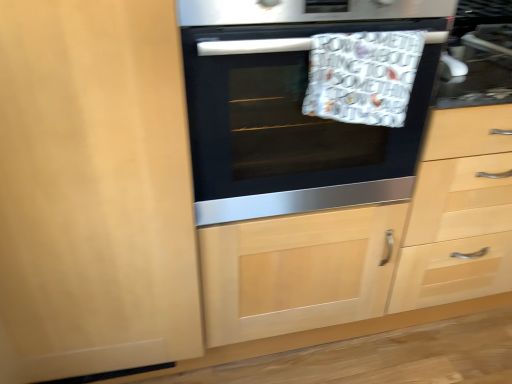
Question: Does black glass oven at center turn towards matte wood dresser at center?

Choices:
 (A) no
 (B) yes

Answer: (A)

Question: Would you say black glass oven at center is outside matte wood dresser at center?

Choices:
 (A) yes
 (B) no

Answer: (A)

Question: Considering the relative sizes of black glass oven at center and matte wood dresser at center in the image provided, is black glass oven at center wider than matte wood dresser at center?

Choices:
 (A) no
 (B) yes

Answer: (B)

Question: Can you confirm if black glass oven at center is thinner than matte wood dresser at center?

Choices:
 (A) no
 (B) yes

Answer: (A)

Question: Does black glass oven at center lie behind matte wood dresser at center?

Choices:
 (A) no
 (B) yes

Answer: (A)

Question: From a real-world perspective, is black glass oven at center positioned over matte wood dresser at center based on gravity?

Choices:
 (A) no
 (B) yes

Answer: (B)

Question: Is matte wood dresser at center positioned before black glass oven at center?

Choices:
 (A) no
 (B) yes

Answer: (A)

Question: Is matte wood dresser at center positioned far away from black glass oven at center?

Choices:
 (A) yes
 (B) no

Answer: (B)

Question: Is matte wood dresser at center thinner than black glass oven at center?

Choices:
 (A) yes
 (B) no

Answer: (A)

Question: Considering the relative sizes of matte wood dresser at center and black glass oven at center in the image provided, is matte wood dresser at center shorter than black glass oven at center?

Choices:
 (A) no
 (B) yes

Answer: (A)

Question: From a real-world perspective, does matte wood dresser at center sit lower than black glass oven at center?

Choices:
 (A) no
 (B) yes

Answer: (B)

Question: Is matte wood dresser at center outside of black glass oven at center?

Choices:
 (A) no
 (B) yes

Answer: (B)

Question: Do you think black glass oven at center is within matte wood dresser at center, or outside of it?

Choices:
 (A) outside
 (B) inside

Answer: (A)